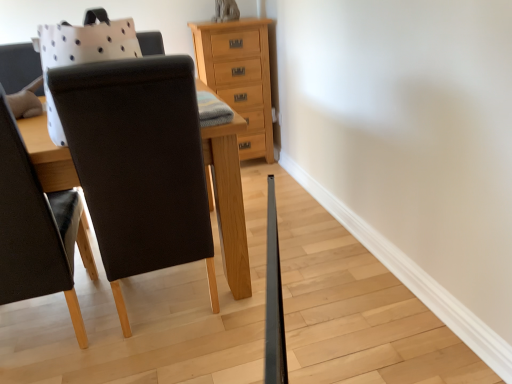
The height and width of the screenshot is (384, 512). Find the location of `natural wood chest of drawers at upper center`. natural wood chest of drawers at upper center is located at coordinates (239, 76).

Is matte black chair at left not within wooden table at center?

That's correct, matte black chair at left is outside of wooden table at center.

How different are the orientations of matte black chair at left and wooden table at center in degrees?

The angular difference between matte black chair at left and wooden table at center is 1.97e-05 degrees.

Is matte black chair at left facing towards wooden table at center?

No, matte black chair at left is not aimed at wooden table at center.

Would you say matte black chair at left is a long distance from wooden table at center?

matte black chair at left is actually quite close to wooden table at center.

Which object is thinner, natural wood chest of drawers at upper center or matte black chair at left?

natural wood chest of drawers at upper center.

Is natural wood chest of drawers at upper center with matte black chair at left?

There is a gap between natural wood chest of drawers at upper center and matte black chair at left.

Can you tell me how much natural wood chest of drawers at upper center and matte black chair at left differ in facing direction?

There is a 179-degree angle between the facing directions of natural wood chest of drawers at upper center and matte black chair at left.

Measure the distance from natural wood chest of drawers at upper center to matte black chair at left.

natural wood chest of drawers at upper center and matte black chair at left are 1.56 meters apart from each other.

Is wooden table at center inside or outside of natural wood chest of drawers at upper center?

wooden table at center is not inside natural wood chest of drawers at upper center, it's outside.

Based on their positions, is wooden table at center located to the left or right of natural wood chest of drawers at upper center?

Clearly, wooden table at center is on the left of natural wood chest of drawers at upper center in the image.

Is wooden table at center with natural wood chest of drawers at upper center?

No, wooden table at center is not next to natural wood chest of drawers at upper center.

Is wooden table at center oriented away from natural wood chest of drawers at upper center?

That's not correct — wooden table at center is not looking away from natural wood chest of drawers at upper center.

Based on the photo, is matte black chair at left not inside natural wood chest of drawers at upper center?

Yes.

Considering the positions of objects matte black chair at left and natural wood chest of drawers at upper center in the image provided, who is more to the right, matte black chair at left or natural wood chest of drawers at upper center?

Positioned to the right is natural wood chest of drawers at upper center.

Which of these two, matte black chair at left or natural wood chest of drawers at upper center, is smaller?

Smaller between the two is natural wood chest of drawers at upper center.

Which object is further away from the camera taking this photo, matte black chair at left or natural wood chest of drawers at upper center?

natural wood chest of drawers at upper center is further from the camera.

Who is taller, natural wood chest of drawers at upper center or wooden table at center?

wooden table at center.

In the scene shown: Which is nearer, (225, 95) or (60, 152)?

Point (225, 95) appears to be farther away from the viewer than point (60, 152).

Where is `table in front of the natural wood chest of drawers at upper center`? table in front of the natural wood chest of drawers at upper center is located at coordinates (229, 202).

From the image's perspective, between natural wood chest of drawers at upper center and wooden table at center, which one is located above?

From the image's view, natural wood chest of drawers at upper center is above.

Which is less distant, (45, 144) or (13, 200)?

The point (13, 200) is closer.

From the image's perspective, between wooden table at center and matte black chair at left, which one is located above?

wooden table at center, from the image's perspective.

From a real-world perspective, which object stands above the other?

In real-world perspective, wooden table at center is above.

The image size is (512, 384). What are the coordinates of `table that appears on the right of matte black chair at left` in the screenshot? It's located at (229, 202).

You are a GUI agent. You are given a task and a screenshot of the screen. Output one action in this format:
    pyautogui.click(x=<x>, y=<y>)
    Task: Click on the chest of drawers behind the matte black chair at left
    
    Given the screenshot: What is the action you would take?
    pyautogui.click(x=239, y=76)

When comparing their distances from natural wood chest of drawers at upper center, does matte black chair at left or wooden table at center seem closer?

wooden table at center.

Based on their spatial positions, is natural wood chest of drawers at upper center or matte black chair at left closer to wooden table at center?

Among the two, matte black chair at left is located nearer to wooden table at center.

Consider the image. Looking at the image, which one is located closer to wooden table at center, matte black chair at left or natural wood chest of drawers at upper center?

Among the two, matte black chair at left is located nearer to wooden table at center.

Based on their spatial positions, is wooden table at center or natural wood chest of drawers at upper center closer to matte black chair at left?

wooden table at center.

Based on their spatial positions, is natural wood chest of drawers at upper center or wooden table at center further from matte black chair at left?

natural wood chest of drawers at upper center is positioned further to the anchor matte black chair at left.

When comparing their distances from natural wood chest of drawers at upper center, does wooden table at center or matte black chair at left seem closer?

wooden table at center is closer to natural wood chest of drawers at upper center.

What are the coordinates of `table positioned between matte black chair at left and natural wood chest of drawers at upper center from near to far` in the screenshot? It's located at (229, 202).